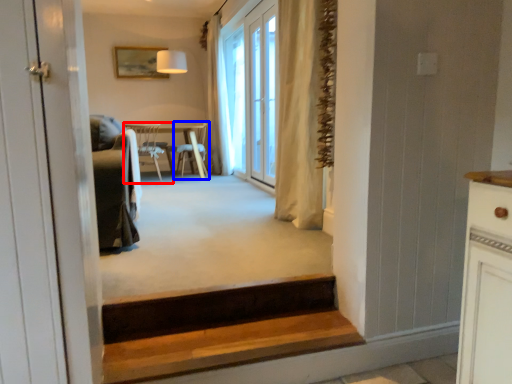
Question: Which object is further to the camera taking this photo, chair (highlighted by a red box) or chair (highlighted by a blue box)?

Choices:
 (A) chair
 (B) chair

Answer: (B)